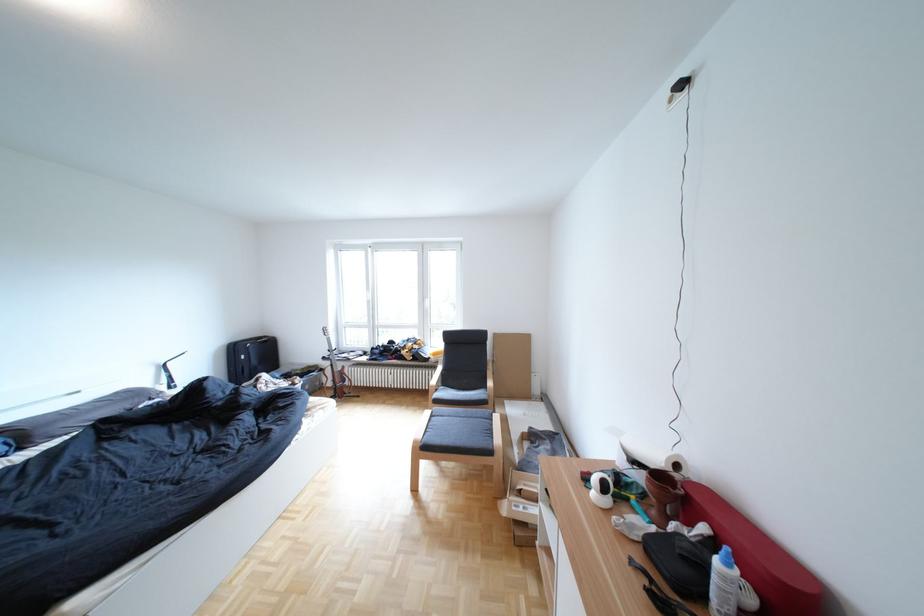
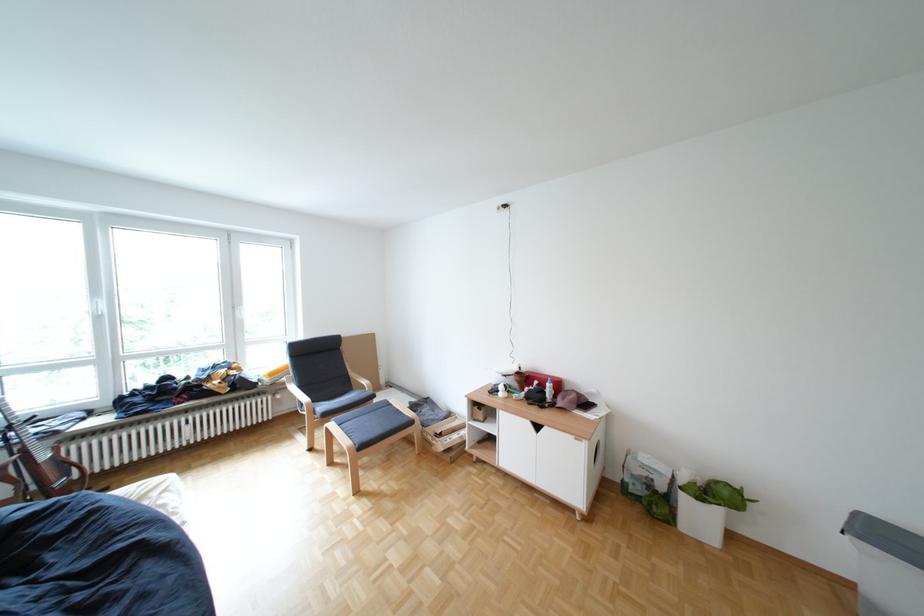
The point at (x=450, y=354) is marked in the first image. Where is the corresponding point in the second image?

(286, 374)